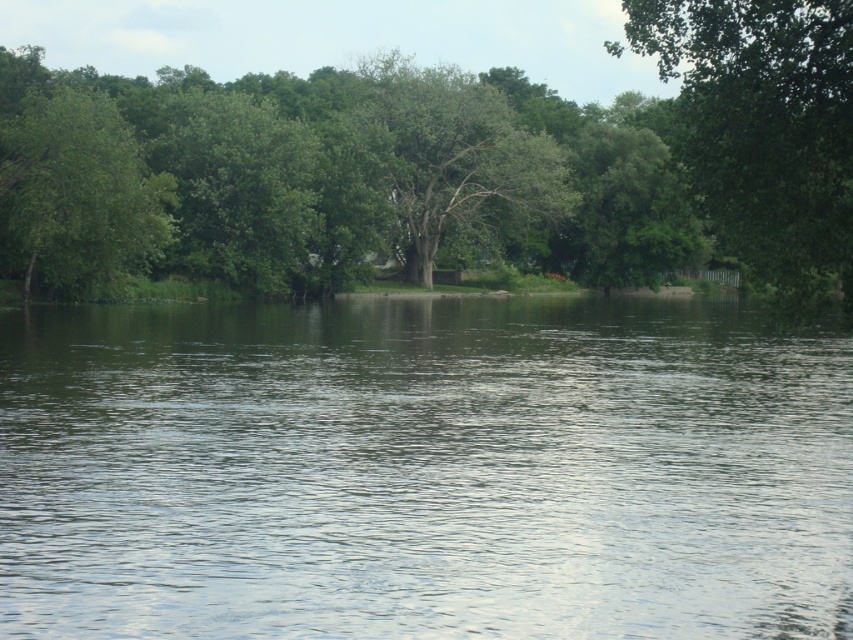
Who is lower down, green leafy tree at upper right or green leafy tree at left?

Positioned lower is green leafy tree at left.

Can you confirm if green leafy tree at upper right is shorter than green leafy tree at left?

Incorrect, green leafy tree at upper right's height does not fall short of green leafy tree at left's.

At what (x,y) coordinates should I click in order to perform the action: click on green leafy tree at upper right. Please return your answer as a coordinate pair (x, y). The height and width of the screenshot is (640, 853). Looking at the image, I should click on (763, 125).

Does point (450, 81) come in front of point (30, 163)?

No, (450, 81) is further to viewer.

I want to click on green leafy tree at center, so click(450, 154).

Between green leafy tree at upper right and green leafy tree at center, which one appears on the right side from the viewer's perspective?

green leafy tree at upper right is more to the right.

Does green leafy tree at upper right have a larger size compared to green leafy tree at center?

Correct, green leafy tree at upper right is larger in size than green leafy tree at center.

Between point (782, 282) and point (462, 195), which one is positioned in front?

Point (782, 282) is more forward.

At what (x,y) coordinates should I click in order to perform the action: click on green leafy tree at upper right. Please return your answer as a coordinate pair (x, y). The height and width of the screenshot is (640, 853). Looking at the image, I should click on (763, 125).